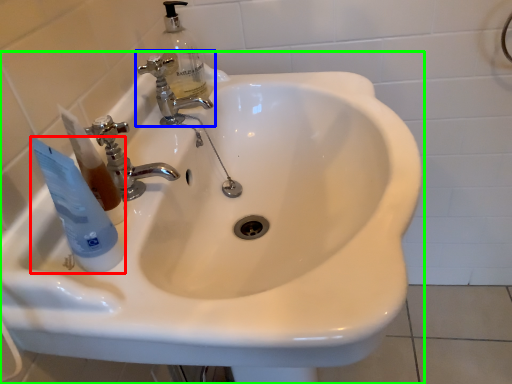
Question: Which object is the closest to the mouthwash (highlighted by a red box)? Choose among these: tap (highlighted by a blue box) or sink (highlighted by a green box).

Choices:
 (A) tap
 (B) sink

Answer: (B)